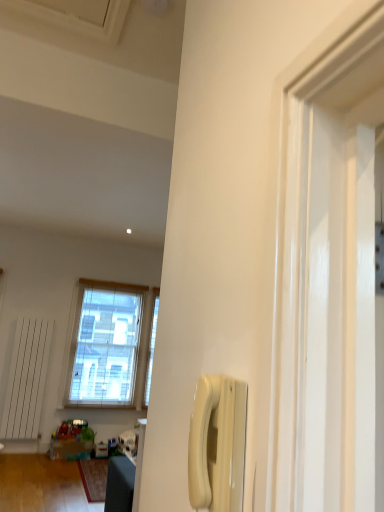
Question: Is white plastic phone at center-right bigger than translucent plastic toys at lower left?

Choices:
 (A) yes
 (B) no

Answer: (B)

Question: Does white plastic phone at center-right come in front of translucent plastic toys at lower left?

Choices:
 (A) yes
 (B) no

Answer: (A)

Question: Is translucent plastic toys at lower left completely or partially inside white plastic phone at center-right?

Choices:
 (A) no
 (B) yes

Answer: (A)

Question: From a real-world perspective, is white plastic phone at center-right over translucent plastic toys at lower left?

Choices:
 (A) no
 (B) yes

Answer: (B)

Question: Can you confirm if white plastic phone at center-right is thinner than translucent plastic toys at lower left?

Choices:
 (A) no
 (B) yes

Answer: (B)

Question: Considering the positions of point (226, 429) and point (145, 291), is point (226, 429) closer or farther from the camera than point (145, 291)?

Choices:
 (A) farther
 (B) closer

Answer: (B)

Question: Based on their positions, is white plastic phone at center-right located to the left or right of clear glass window at center?

Choices:
 (A) left
 (B) right

Answer: (B)

Question: Based on their sizes in the image, would you say white plastic phone at center-right is bigger or smaller than clear glass window at center?

Choices:
 (A) small
 (B) big

Answer: (A)

Question: From the image's perspective, is white plastic phone at center-right above or below clear glass window at center?

Choices:
 (A) above
 (B) below

Answer: (A)

Question: Is clear glass window at center wider or thinner than white plastic phone at center-right?

Choices:
 (A) thin
 (B) wide

Answer: (B)

Question: Is point (77, 324) closer or farther from the camera than point (235, 384)?

Choices:
 (A) closer
 (B) farther

Answer: (B)

Question: Is clear glass window at center inside or outside of white plastic phone at center-right?

Choices:
 (A) outside
 (B) inside

Answer: (A)

Question: Visually, is clear glass window at center positioned to the left or to the right of white plastic phone at center-right?

Choices:
 (A) right
 (B) left

Answer: (B)

Question: Considering the positions of clear glass window at center and translucent plastic toys at lower left in the image, is clear glass window at center taller or shorter than translucent plastic toys at lower left?

Choices:
 (A) tall
 (B) short

Answer: (A)

Question: Choose the correct answer: Is clear glass window at center inside translucent plastic toys at lower left or outside it?

Choices:
 (A) outside
 (B) inside

Answer: (A)